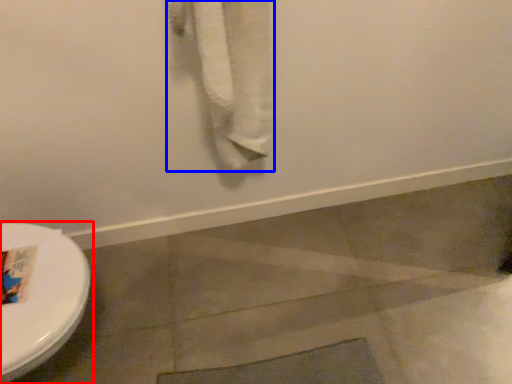
Question: Which point is closer to the camera, toilet (highlighted by a red box) or bath towel (highlighted by a blue box)?

Choices:
 (A) toilet
 (B) bath towel

Answer: (B)